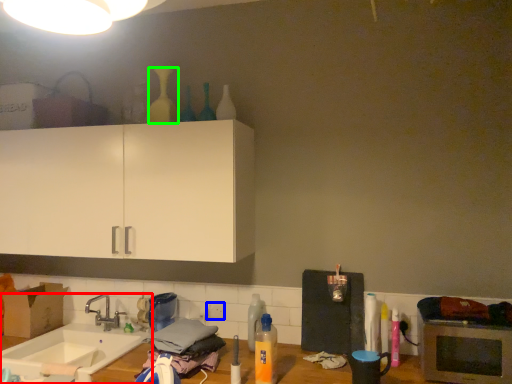
Question: Which is nearer to the sink (highlighted by a red box)? electric outlet (highlighted by a blue box) or bottle (highlighted by a green box).

Choices:
 (A) electric outlet
 (B) bottle

Answer: (A)